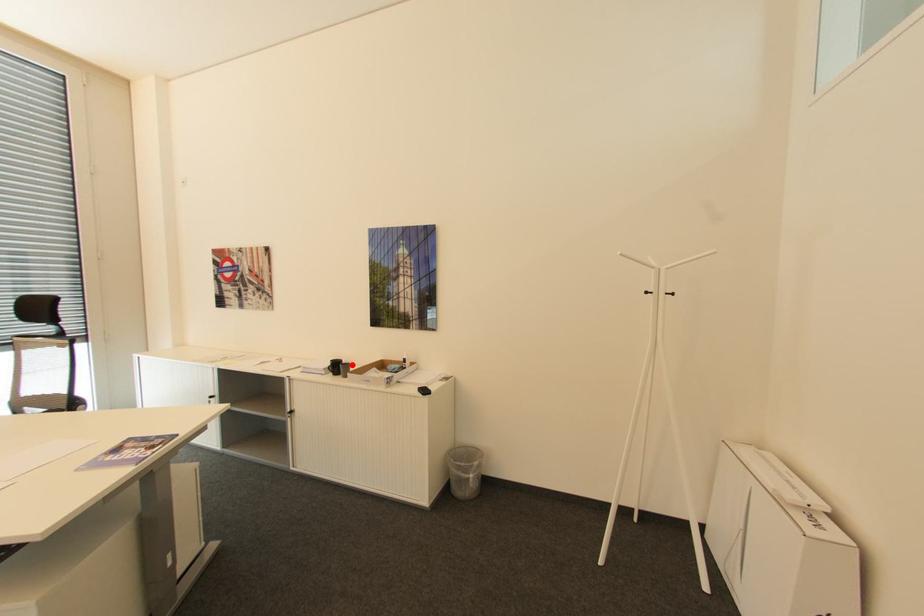
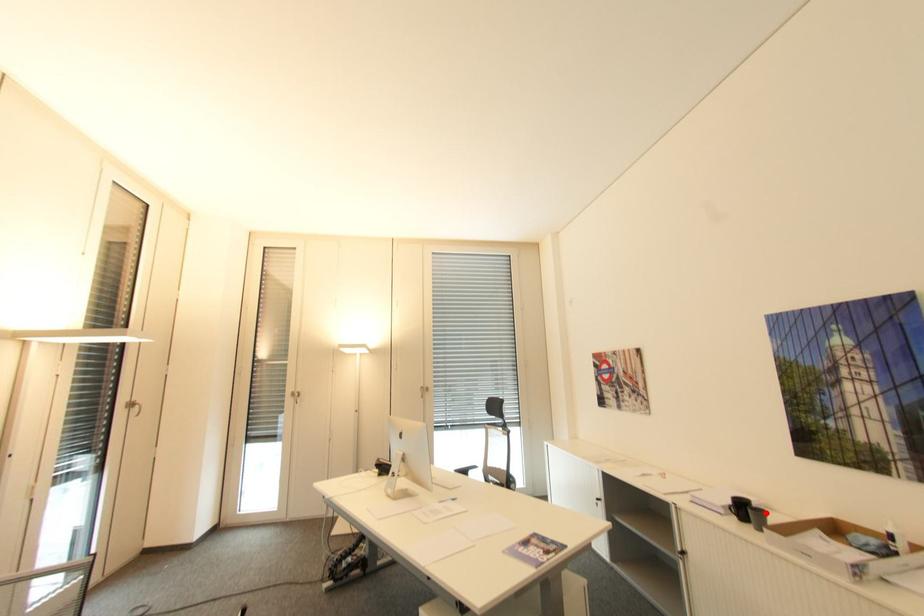
I am providing you with two images of the same scene from different viewpoints. A red point is marked on the first image and another point is marked on the second image. Is the marked point in image1 the same physical position as the marked point in image2?

Yes